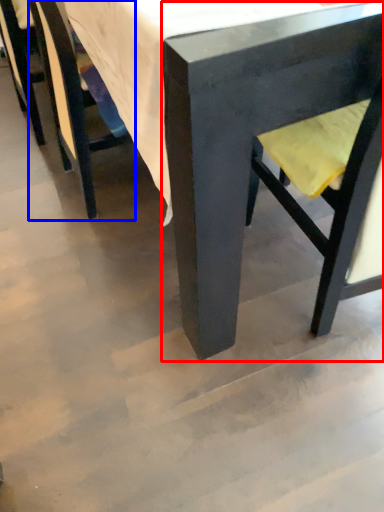
Question: Among these objects, which one is farthest to the camera, chair (highlighted by a red box) or chair (highlighted by a blue box)?

Choices:
 (A) chair
 (B) chair

Answer: (B)